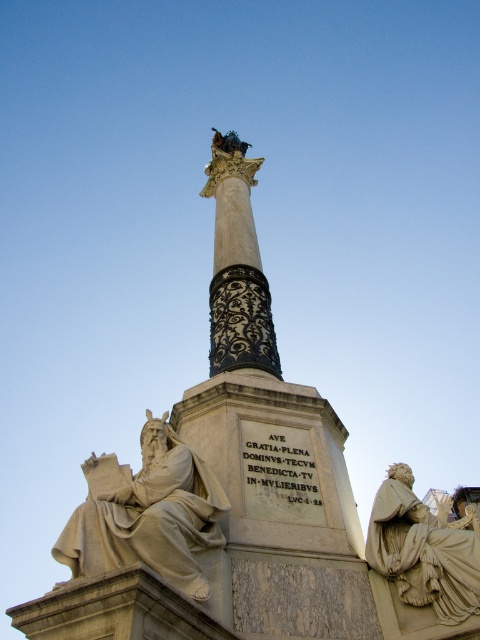
You are an art conservator assessing the monument. You need to determine which object requires more protective covering material based on their sizes. Which one would need more material between the white marble statue at lower left and the black marble column at center?

The white marble statue at lower left requires more protective covering material because it has a larger size compared to the black marble column at center.

You are a tourist standing at the base of the monument. You want to take a photo of the beige stone statue at lower right without any obstructions. Given that the statue is 87.97 feet away from you, is it possible to capture the entire statue in your camera frame without moving closer?

The beige stone statue at lower right is 87.97 feet away from the viewer. Since most standard cameras have a wide enough angle to capture objects at that distance without needing to move closer, it should be possible to take a photo of the entire statue without obstructions.